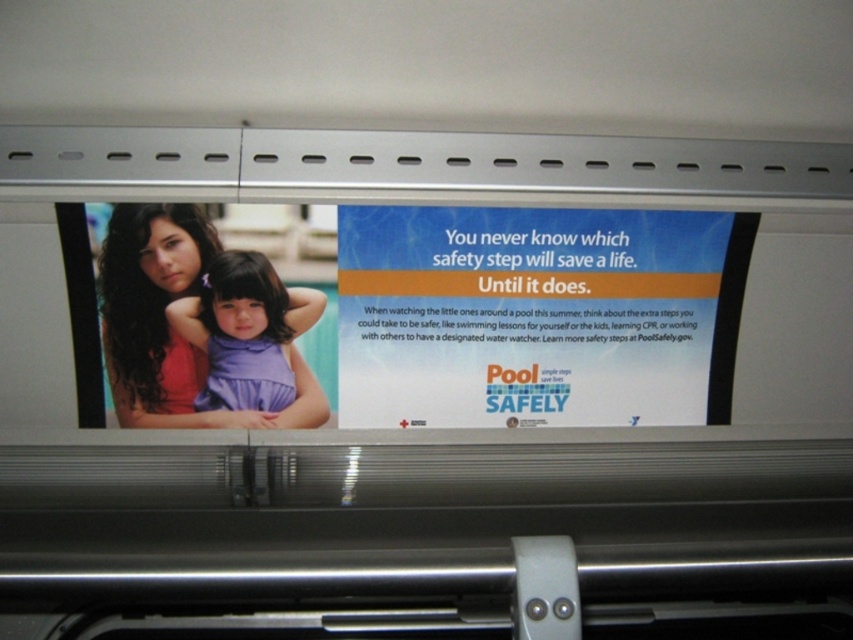
You are standing 1.07 meters away from the point at coordinates point (379,218). If you want to move closer to it, which direction should you move?

Since you are already at the same distance as the point (379,218), you are already at the correct position. No need to move closer.

You are standing in front of the public safety advertisement on the bus. You notice two points marked on the ad. The first point is at coordinates point (701, 356), and the second point is at coordinates point (302, 312). From your perspective, which point is farther away from you?

Point (701, 356) is behind point (302, 312), so the point at (701, 356) is farther away from you.